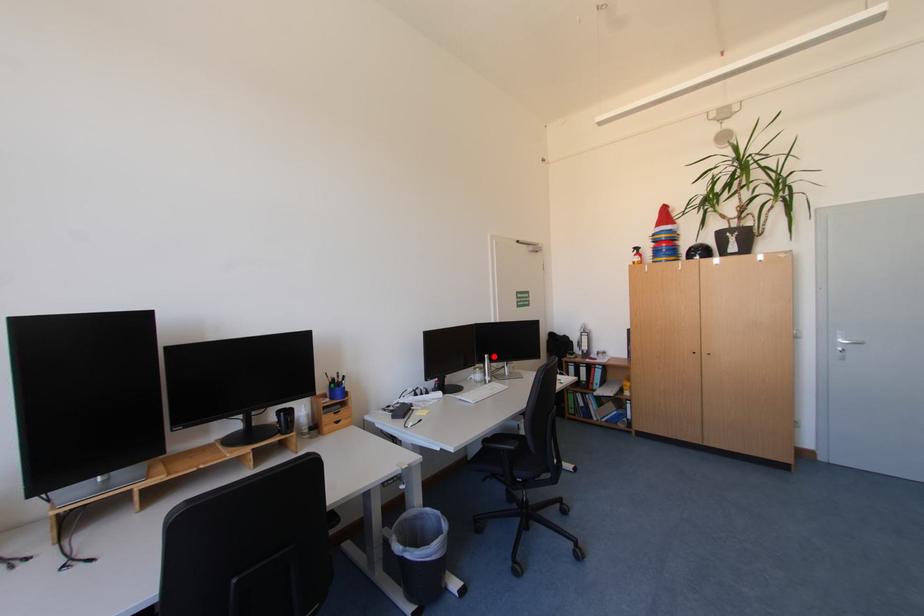
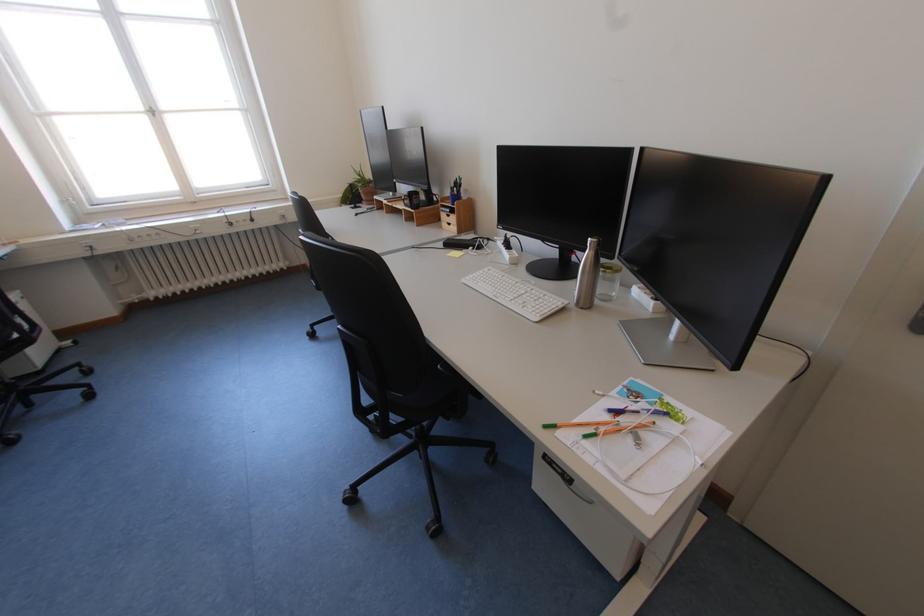
The point at the highlighted location is marked in the first image. Where is the corresponding point in the second image?

(599, 240)